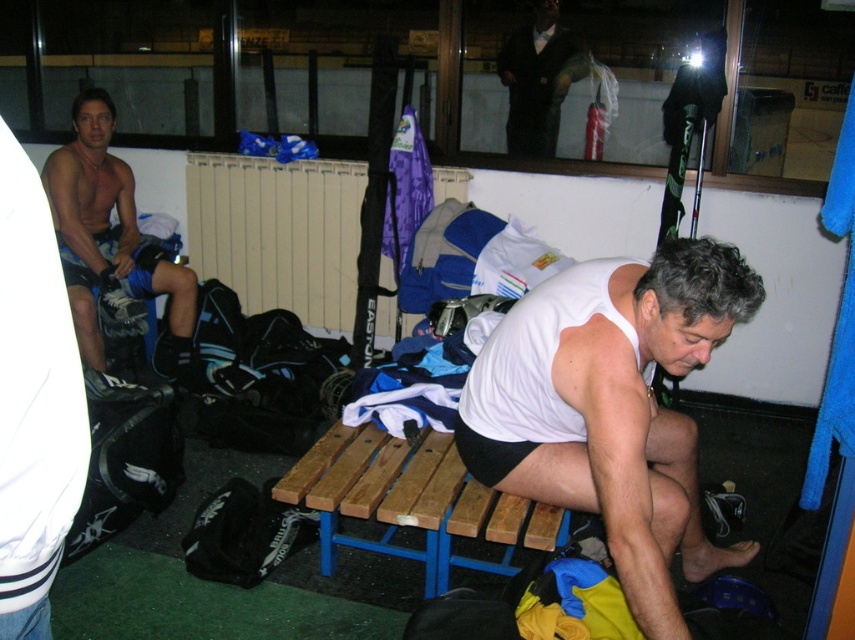
Question: Which point is farther to the camera?

Choices:
 (A) (25, 516)
 (B) (131, 340)
 (C) (514, 352)

Answer: (B)

Question: Is the position of wooden bench at center more distant than that of matte black shorts at left?

Choices:
 (A) yes
 (B) no

Answer: (B)

Question: Based on their relative distances, which object is nearer to the black fabric shorts at left?

Choices:
 (A) matte black shorts at left
 (B) wooden bench at center

Answer: (B)

Question: Can you confirm if white matte tank top at center is positioned below matte black shorts at left?

Choices:
 (A) no
 (B) yes

Answer: (B)

Question: Observing the image, what is the correct spatial positioning of white matte tank top at center in reference to black fabric shorts at left?

Choices:
 (A) left
 (B) right

Answer: (B)

Question: Which object is positioned farthest from the wooden bench at center?

Choices:
 (A) black fabric shorts at left
 (B) matte black shorts at left
 (C) white matte tank top at center

Answer: (B)